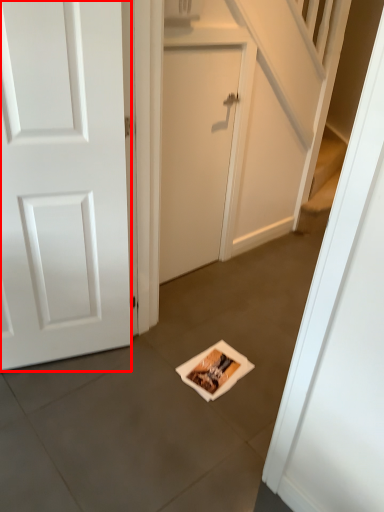
Question: From the image's perspective, what is the correct spatial positioning of door (annotated by the red box) in reference to door?

Choices:
 (A) above
 (B) below

Answer: (B)